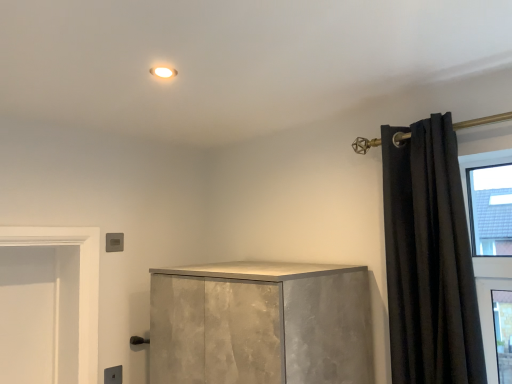
At what (x,y) coordinates should I click in order to perform the action: click on black velvet curtain at right. Please return your answer as a coordinate pair (x, y). Looking at the image, I should click on (429, 259).

Describe the element at coordinates (429, 259) in the screenshot. I see `black velvet curtain at right` at that location.

Image resolution: width=512 pixels, height=384 pixels. Describe the element at coordinates (113, 375) in the screenshot. I see `matte gray electric outlet at lower left` at that location.

Image resolution: width=512 pixels, height=384 pixels. I want to click on matte gray electric outlet at lower left, so (x=113, y=375).

What is the approximate height of matte gray electric outlet at lower left?

It is 3.57 inches.

This screenshot has width=512, height=384. I want to click on black velvet curtain at right, so click(x=429, y=259).

Does black velvet curtain at right appear on the right side of matte gray electric outlet at lower left?

Correct, you'll find black velvet curtain at right to the right of matte gray electric outlet at lower left.

Relative to matte gray electric outlet at lower left, is black velvet curtain at right in front or behind?

black velvet curtain at right is positioned closer to the viewer than matte gray electric outlet at lower left.

Which is behind, point (409, 191) or point (115, 371)?

The point (115, 371) is farther.

From the image's perspective, does black velvet curtain at right appear higher than matte gray electric outlet at lower left?

Indeed, from the image's perspective, black velvet curtain at right is shown above matte gray electric outlet at lower left.

From a real-world perspective, which object stands above the other?

black velvet curtain at right, from a real-world perspective.

Which object is thinner, black velvet curtain at right or matte gray electric outlet at lower left?

matte gray electric outlet at lower left.

Is black velvet curtain at right taller or shorter than matte gray electric outlet at lower left?

Clearly, black velvet curtain at right is taller compared to matte gray electric outlet at lower left.

Considering the relative sizes of black velvet curtain at right and matte gray electric outlet at lower left in the image provided, is black velvet curtain at right bigger than matte gray electric outlet at lower left?

Indeed, black velvet curtain at right has a larger size compared to matte gray electric outlet at lower left.

Would you say black velvet curtain at right is outside matte gray electric outlet at lower left?

Yes, black velvet curtain at right is outside of matte gray electric outlet at lower left.

Consider the image. Is black velvet curtain at right placed right next to matte gray electric outlet at lower left?

They are not placed beside each other.

Does black velvet curtain at right turn towards matte gray electric outlet at lower left?

Answer: No, black velvet curtain at right is not turned towards matte gray electric outlet at lower left.

Where is `curtain lying on the right of matte gray electric outlet at lower left`? This screenshot has width=512, height=384. curtain lying on the right of matte gray electric outlet at lower left is located at coordinates (429, 259).

Does matte gray electric outlet at lower left appear on the left side of black velvet curtain at right?

Correct, you'll find matte gray electric outlet at lower left to the left of black velvet curtain at right.

Is matte gray electric outlet at lower left in front of or behind black velvet curtain at right in the image?

matte gray electric outlet at lower left is behind black velvet curtain at right.

Does point (104, 369) appear closer or farther from the camera than point (438, 261)?

Point (104, 369).

From the image's perspective, relative to black velvet curtain at right, is matte gray electric outlet at lower left above or below?

Based on their image positions, matte gray electric outlet at lower left is located beneath black velvet curtain at right.

From a real-world perspective, which is physically above, matte gray electric outlet at lower left or black velvet curtain at right?

black velvet curtain at right, from a real-world perspective.

Looking at this image, in terms of width, does matte gray electric outlet at lower left look wider or thinner when compared to black velvet curtain at right?

matte gray electric outlet at lower left is thinner than black velvet curtain at right.

Considering the sizes of objects matte gray electric outlet at lower left and black velvet curtain at right in the image provided, who is taller, matte gray electric outlet at lower left or black velvet curtain at right?

black velvet curtain at right.

Can you confirm if matte gray electric outlet at lower left is smaller than black velvet curtain at right?

Indeed, matte gray electric outlet at lower left has a smaller size compared to black velvet curtain at right.

Would you say matte gray electric outlet at lower left is outside black velvet curtain at right?

Absolutely, matte gray electric outlet at lower left is external to black velvet curtain at right.

Is matte gray electric outlet at lower left next to black velvet curtain at right?

No, matte gray electric outlet at lower left is not in contact with black velvet curtain at right.

Looking at this image, is matte gray electric outlet at lower left facing away from black velvet curtain at right?

No, matte gray electric outlet at lower left's orientation is not away from black velvet curtain at right.

How different are the orientations of matte gray electric outlet at lower left and black velvet curtain at right in degrees?

They differ by 88.2 degrees in their facing directions.

Locate an element on the screen. The width and height of the screenshot is (512, 384). curtain that appears in front of the matte gray electric outlet at lower left is located at coordinates (429, 259).

Locate an element on the screen. The image size is (512, 384). curtain in front of the matte gray electric outlet at lower left is located at coordinates (429, 259).

This screenshot has width=512, height=384. Find the location of `curtain on the right of the matte gray electric outlet at lower left`. curtain on the right of the matte gray electric outlet at lower left is located at coordinates (429, 259).